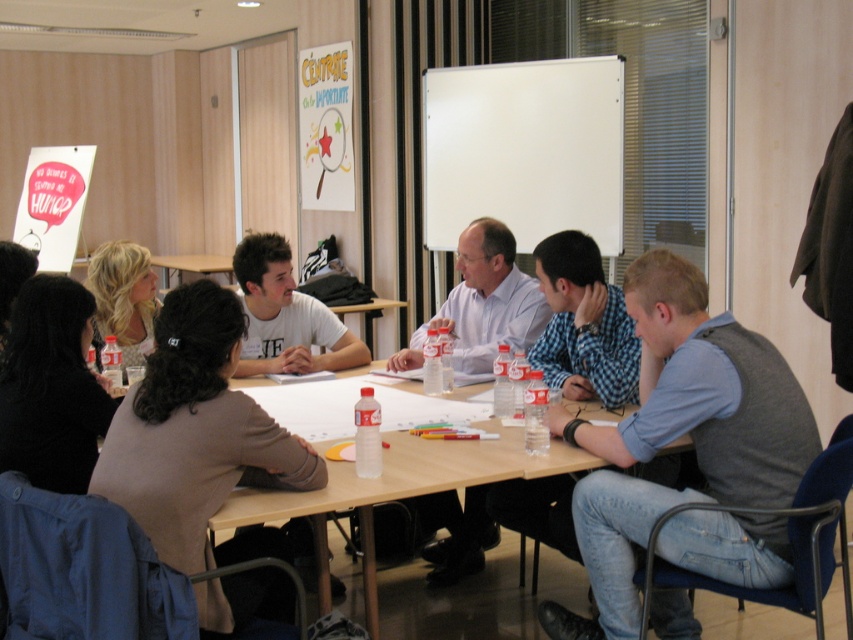
Can you confirm if black sweater at left is positioned to the left of matte white shirt at center?

Indeed, black sweater at left is positioned on the left side of matte white shirt at center.

Which is below, black sweater at left or matte white shirt at center?

black sweater at left is lower down.

Is point (80, 433) closer to viewer compared to point (503, 273)?

Yes, it is.

This screenshot has height=640, width=853. In order to click on black sweater at left in this screenshot , I will do `click(51, 387)`.

Between brown sweater at left and wooden table at center, which one has less height?

wooden table at center is shorter.

Which is in front, point (235, 548) or point (450, 476)?

Positioned in front is point (450, 476).

What do you see at coordinates (198, 436) in the screenshot? This screenshot has width=853, height=640. I see `brown sweater at left` at bounding box center [198, 436].

At what (x,y) coordinates should I click in order to perform the action: click on brown sweater at left. Please return your answer as a coordinate pair (x, y). This screenshot has width=853, height=640. Looking at the image, I should click on (198, 436).

Between point (340, 497) and point (444, 492), which one is positioned behind?

Point (444, 492)

Is point (534, 476) positioned after point (486, 237)?

No, it is not.

In order to click on wooden table at center in this screenshot , I will do `click(395, 492)`.